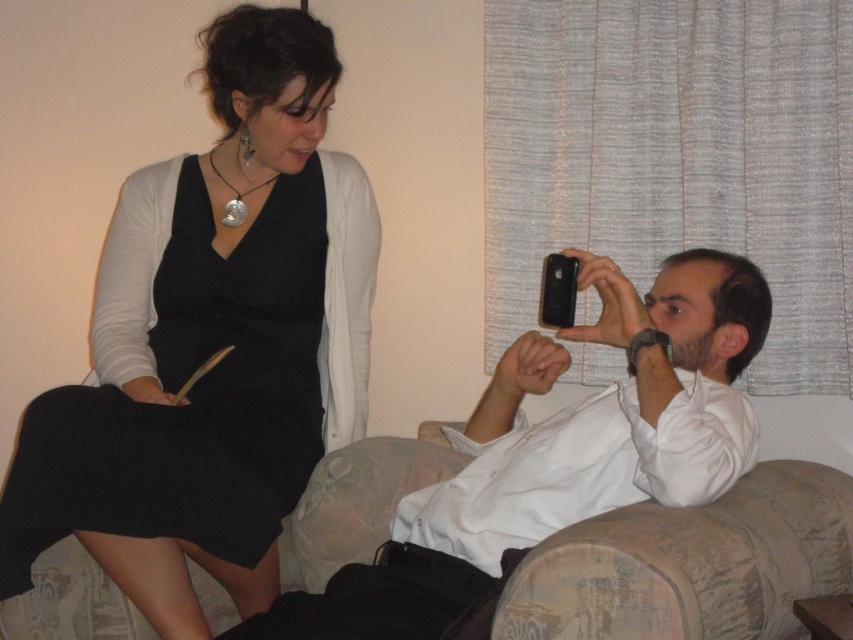
Question: Among these objects, which one is farthest from the camera?

Choices:
 (A) white matte shirt at center
 (B) silver metallic pendant at upper center
 (C) black matte dress at left

Answer: (B)

Question: Which object appears closest to the camera in this image?

Choices:
 (A) white matte shirt at center
 (B) silver metallic pendant at upper center

Answer: (A)

Question: Based on their relative distances, which object is nearer to the white matte shirt at center?

Choices:
 (A) silver metallic pendant at upper center
 (B) black matte dress at left

Answer: (B)

Question: Is white matte shirt at center above silver metallic pendant at upper center?

Choices:
 (A) yes
 (B) no

Answer: (B)

Question: Is white matte shirt at center below silver metallic pendant at upper center?

Choices:
 (A) yes
 (B) no

Answer: (A)

Question: Does white matte shirt at center appear over black matte dress at left?

Choices:
 (A) no
 (B) yes

Answer: (A)